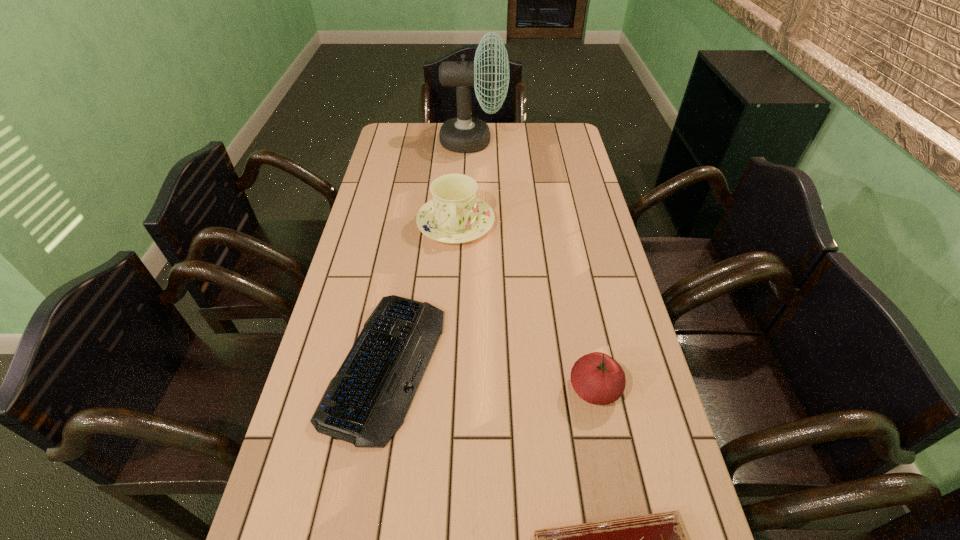
This screenshot has height=540, width=960. Identify the location of the farthest object. (464, 134).

Locate an element on the screen. Image resolution: width=960 pixels, height=540 pixels. the tallest object is located at coordinates (464, 134).

The image size is (960, 540). Identify the location of the fourth shortest object. (455, 215).

Identify the location of the fourth nearest object. The width and height of the screenshot is (960, 540). (455, 215).

At what (x,y) coordinates should I click in order to perform the action: click on the third tallest object. Please return your answer as a coordinate pair (x, y). The image size is (960, 540). Looking at the image, I should click on [x=597, y=378].

Identify the location of computer keyboard. The height and width of the screenshot is (540, 960). (365, 403).

This screenshot has height=540, width=960. In order to click on free space located in front of the farthest object where the airflow is directed in this screenshot , I will do `click(559, 141)`.

I want to click on vacant space located on the handle side of the fourth shortest object, so click(447, 372).

The image size is (960, 540). I want to click on vacant area located 0.100m on the back of the third tallest object, so click(x=583, y=331).

Where is `vacant space located 0.360m on the back of the computer keyboard`? This screenshot has width=960, height=540. vacant space located 0.360m on the back of the computer keyboard is located at coordinates (411, 212).